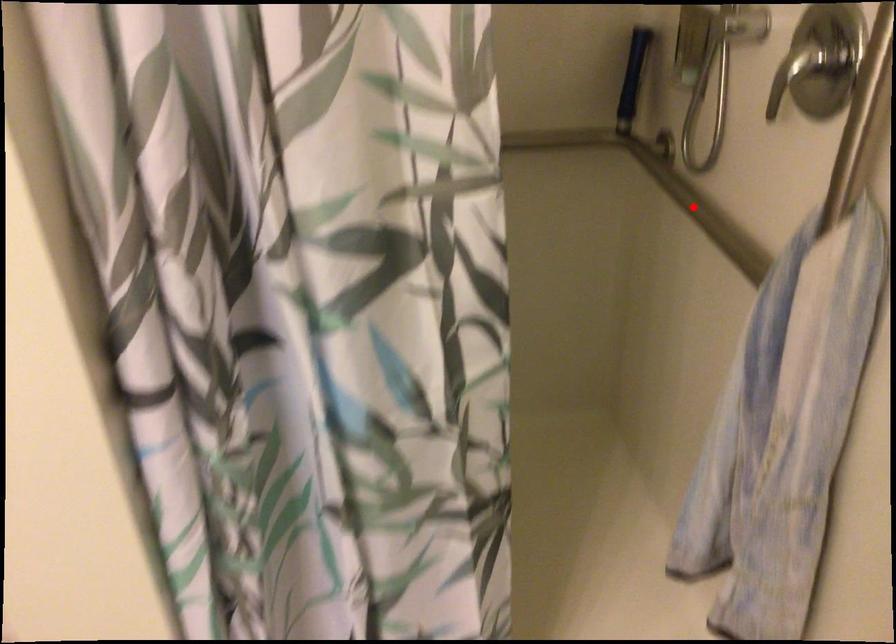
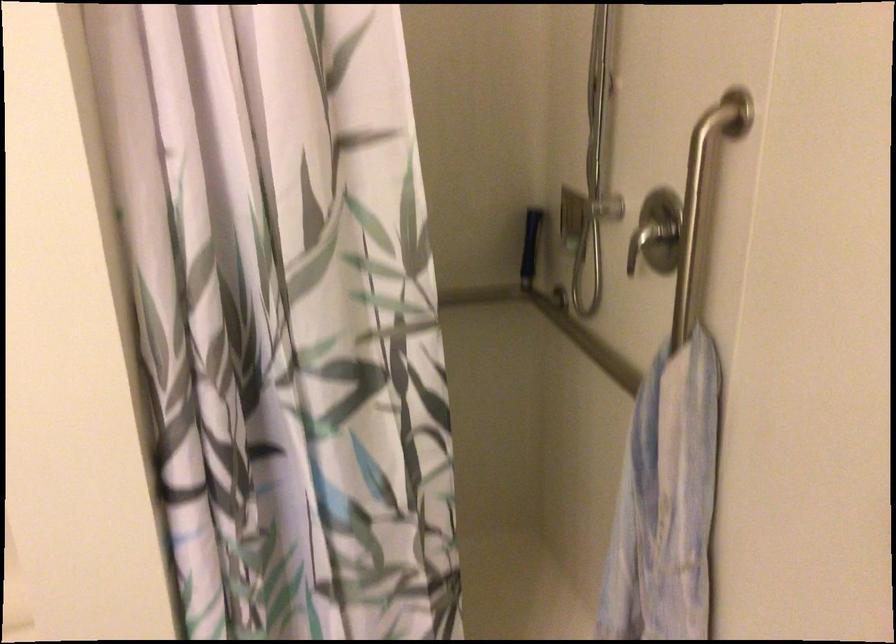
In the second image, find the point that corresponds to the highlighted location in the first image.

(586, 341)